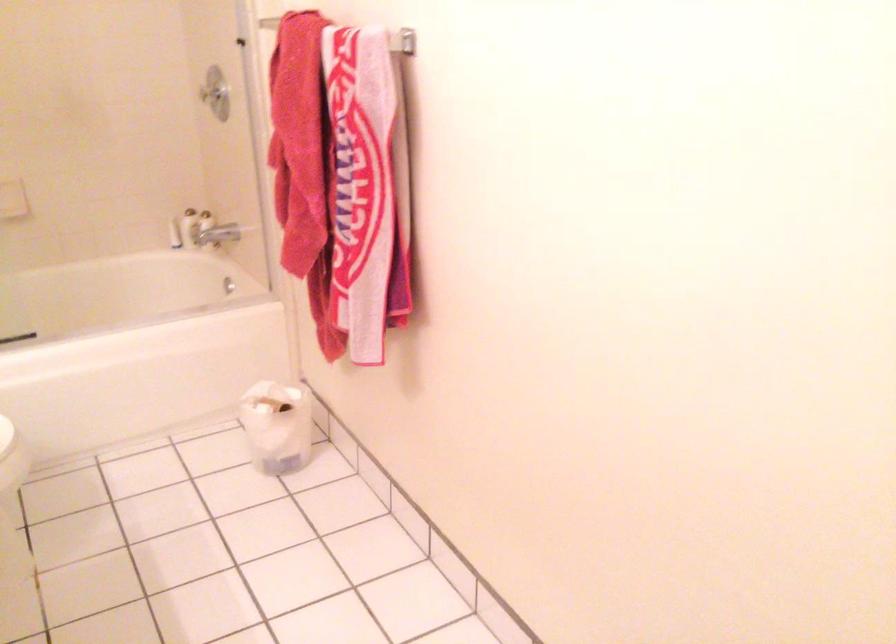
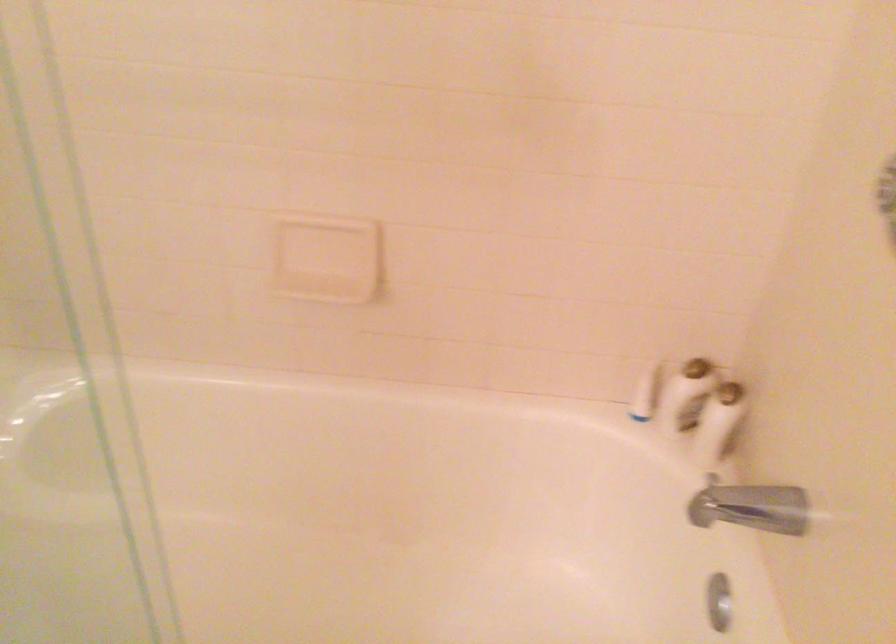
Find the pixel in the second image that matches pixel 208 225 in the first image.

(718, 422)